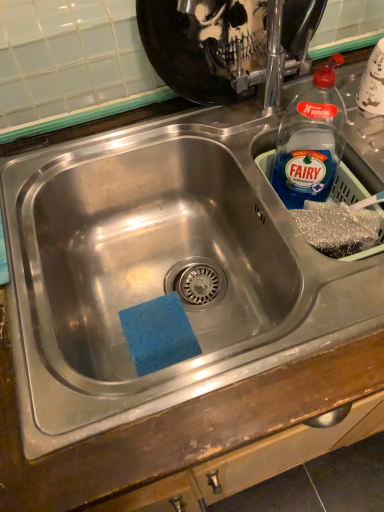
The image size is (384, 512). In order to click on transparent plastic bottle at upper right in this screenshot , I will do `click(310, 141)`.

What do you see at coordinates (310, 141) in the screenshot? This screenshot has height=512, width=384. I see `transparent plastic bottle at upper right` at bounding box center [310, 141].

Find the location of a particular element. The height and width of the screenshot is (512, 384). transparent plastic bottle at upper right is located at coordinates (310, 141).